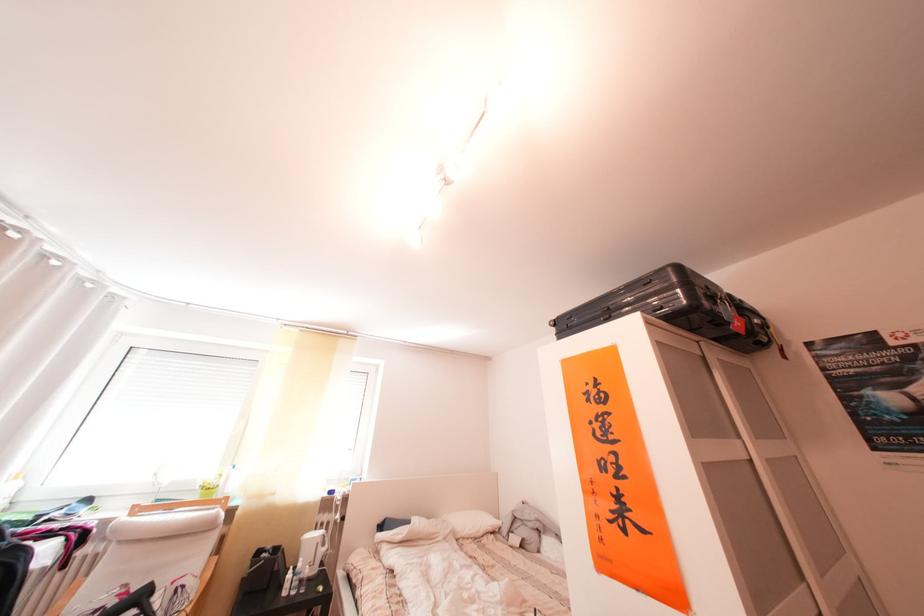
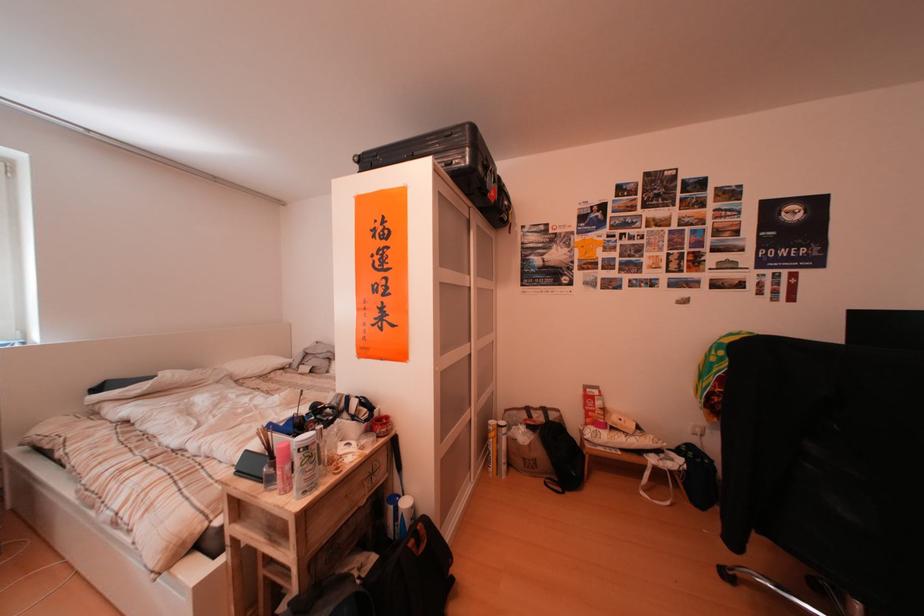
How did the camera likely rotate?

The camera's rotation is toward right-down.